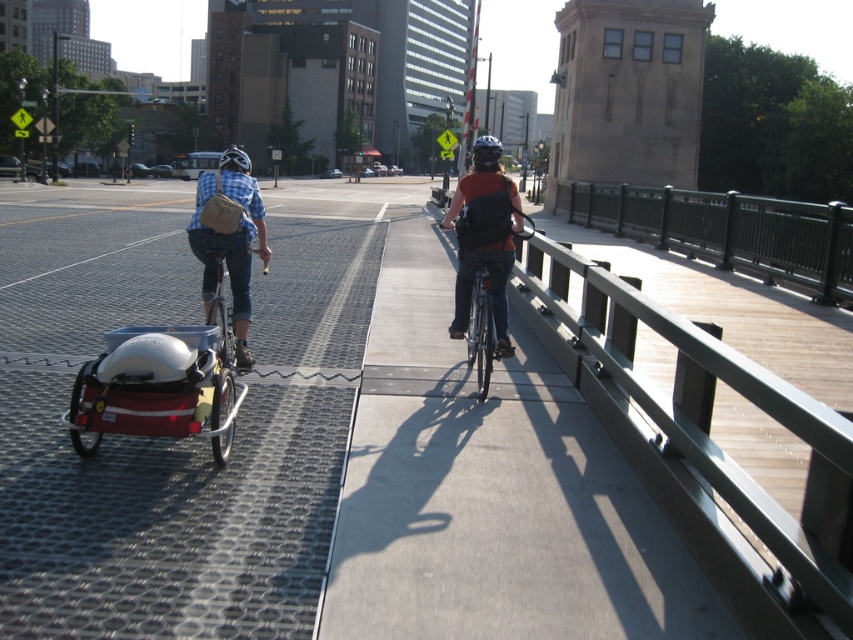
You are a delivery person who needs to park your matte black bicycle at center on the bridge. The bridge has a metal grid surface on one side and a smooth concrete path on the other. According to the pedestrian crossing sign, which side should you park your bicycle to comply with the designated area for cyclists?

The matte black bicycle at center should be parked on the smooth concrete path since it is designated for pedestrians and cyclists as indicated by the pedestrian crossing sign.

You are a delivery person carrying a large package that is 2 meters wide. You need to navigate between the blue plaid shirt at center and the matte black bicycle at center on the pedestrian bridge. Is there enough space for your package to pass through?

The blue plaid shirt at center and matte black bicycle at center are 2.27 meters apart. Since the package is 2 meters wide, there is enough space for it to pass through the gap between them.

You are a cyclist approaching the bridge and notice two cyclists ahead. One is wearing a blue plaid shirt at center and the other has a matte black helmet at upper center. Which cyclist is positioned more to the left?

The matte black helmet at upper center is positioned more to the left since the blue plaid shirt at center is to the right of it.